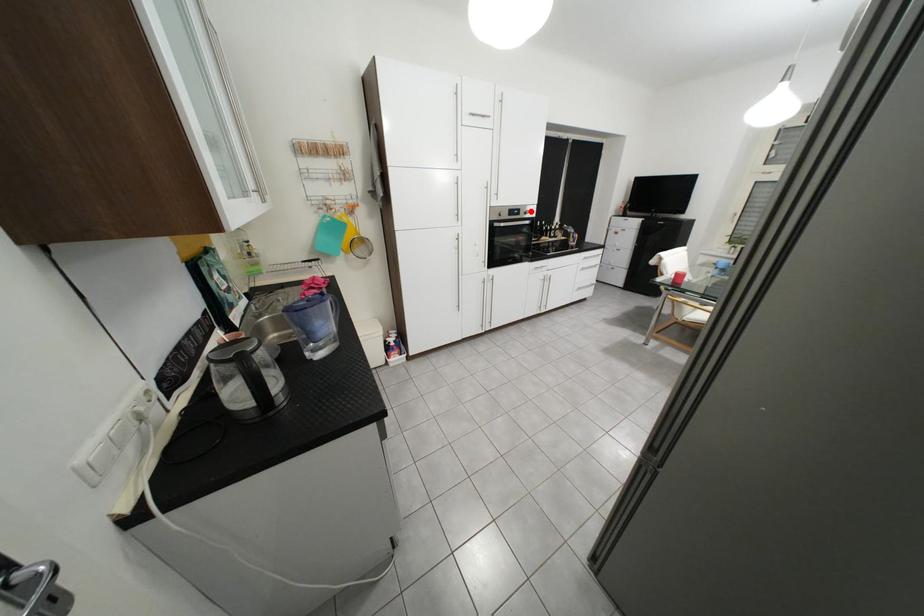
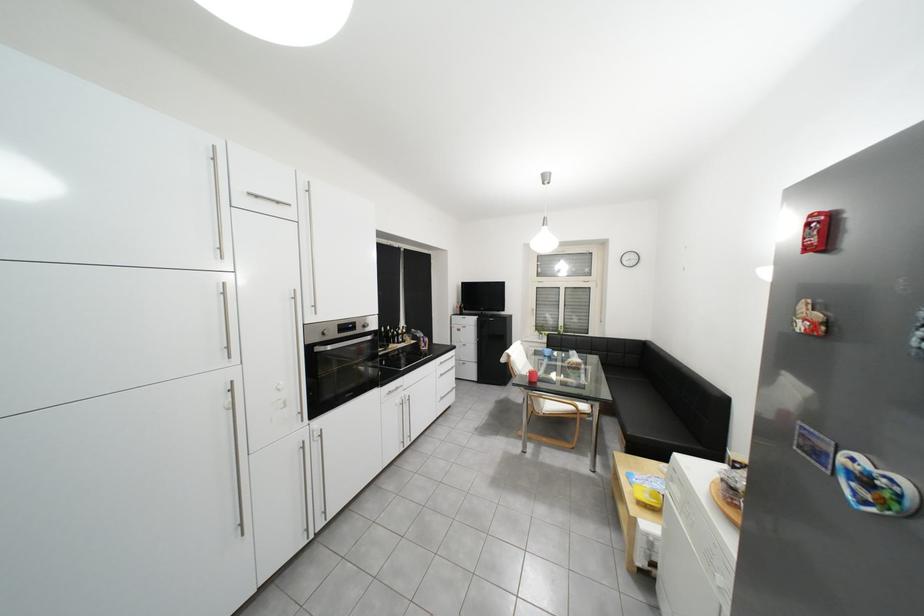
The point at the highlighted location is marked in the first image. Where is the corresponding point in the second image?

(366, 325)